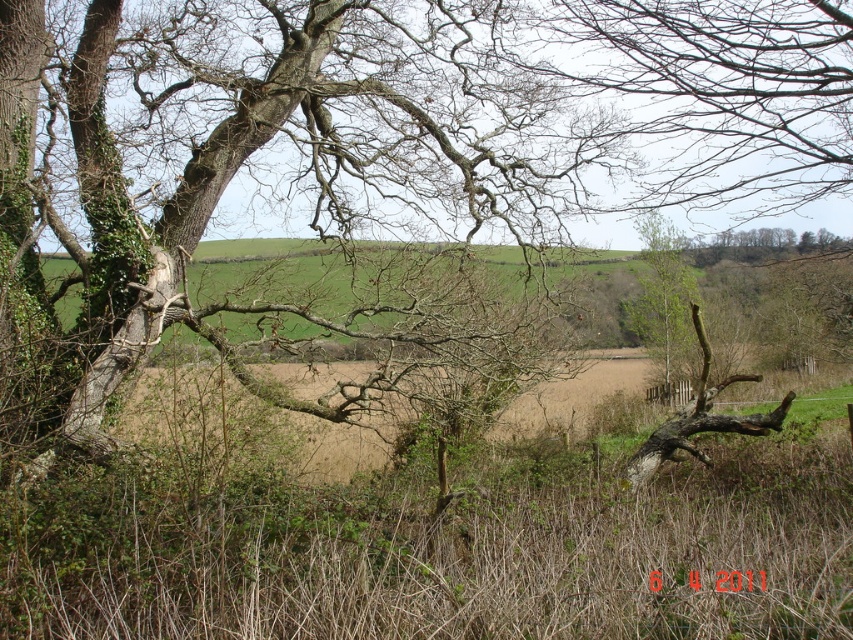
Is point (171, 147) positioned in front of point (683, 262)?

That is True.

Does smooth bark tree at left have a smaller size compared to green leafy tree at center?

Actually, smooth bark tree at left might be larger than green leafy tree at center.

Is point (102, 209) farther from viewer compared to point (675, 337)?

No, (102, 209) is closer to viewer.

This screenshot has width=853, height=640. In order to click on smooth bark tree at left in this screenshot , I will do `click(247, 170)`.